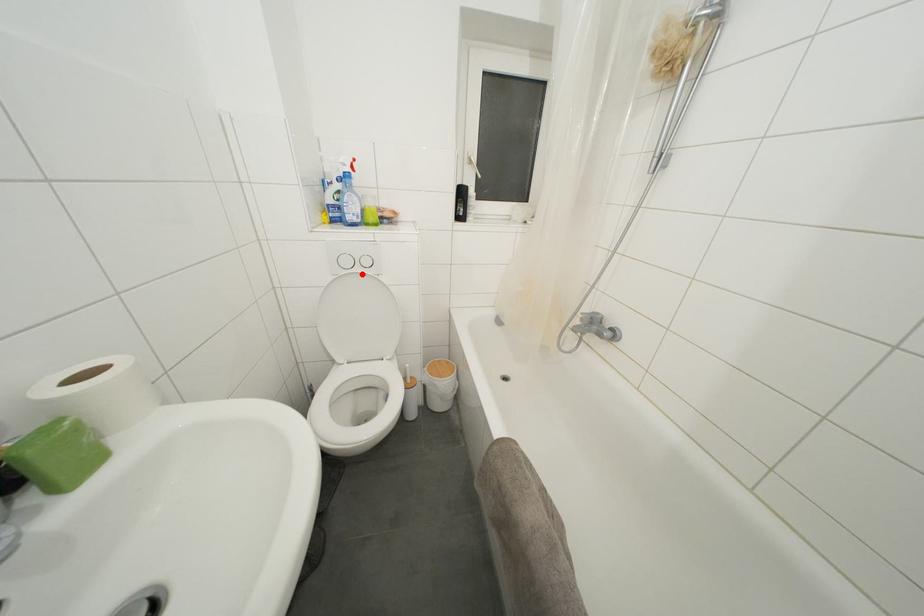
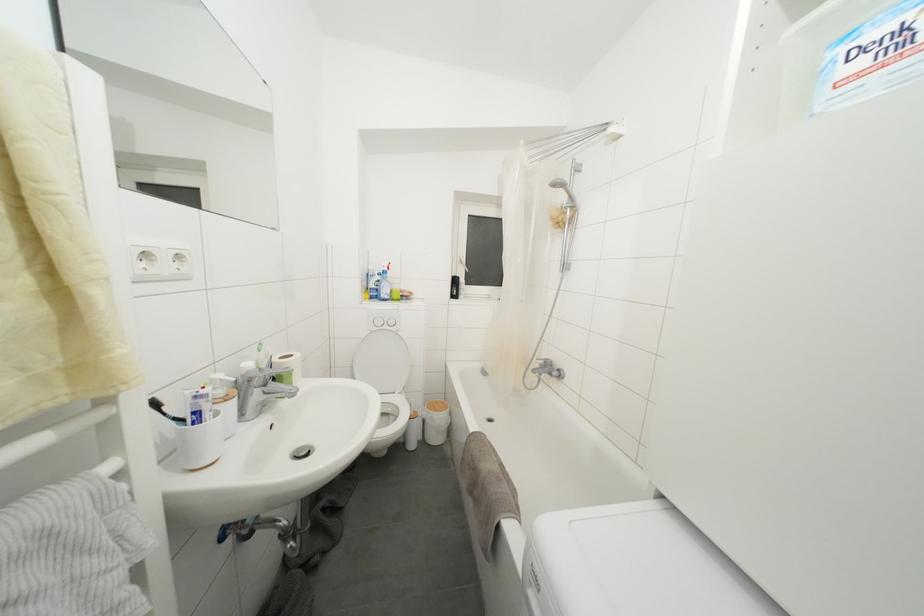
Find the pixel in the second image that matches the highlighted location in the first image.

(390, 331)